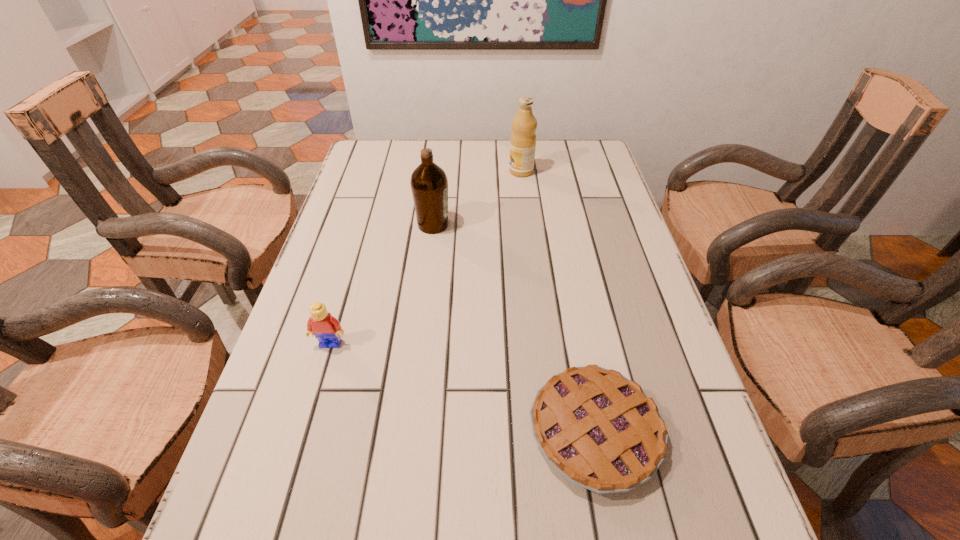
This screenshot has height=540, width=960. I want to click on free location that satisfies the following two spatial constraints: 1. on the label of the farther olive oil; 2. on the right side of the pie, so click(553, 431).

Locate an element on the screen. free space that satisfies the following two spatial constraints: 1. on the label of the farthest object; 2. on the left side of the shortest object is located at coordinates (553, 431).

The height and width of the screenshot is (540, 960). Identify the location of free location that satisfies the following two spatial constraints: 1. on the back side of the shortest object; 2. on the label of the second farthest object. (555, 225).

Identify the location of free space that satisfies the following two spatial constraints: 1. on the label of the shortest object; 2. on the left side of the farther olive oil. (553, 431).

At what (x,y) coordinates should I click in order to perform the action: click on vacant space that satisfies the following two spatial constraints: 1. on the front-facing side of the pie; 2. on the left side of the leftmost object. Please return your answer as a coordinate pair (x, y). The width and height of the screenshot is (960, 540). Looking at the image, I should click on (305, 431).

At what (x,y) coordinates should I click in order to perform the action: click on vacant point that satisfies the following two spatial constraints: 1. on the label of the shortest object; 2. on the left side of the nearer olive oil. Please return your answer as a coordinate pair (x, y). Looking at the image, I should click on (408, 431).

What are the coordinates of `free space that satisfies the following two spatial constraints: 1. on the label of the left olive oil; 2. on the front-facing side of the leftmost object` in the screenshot? It's located at (419, 343).